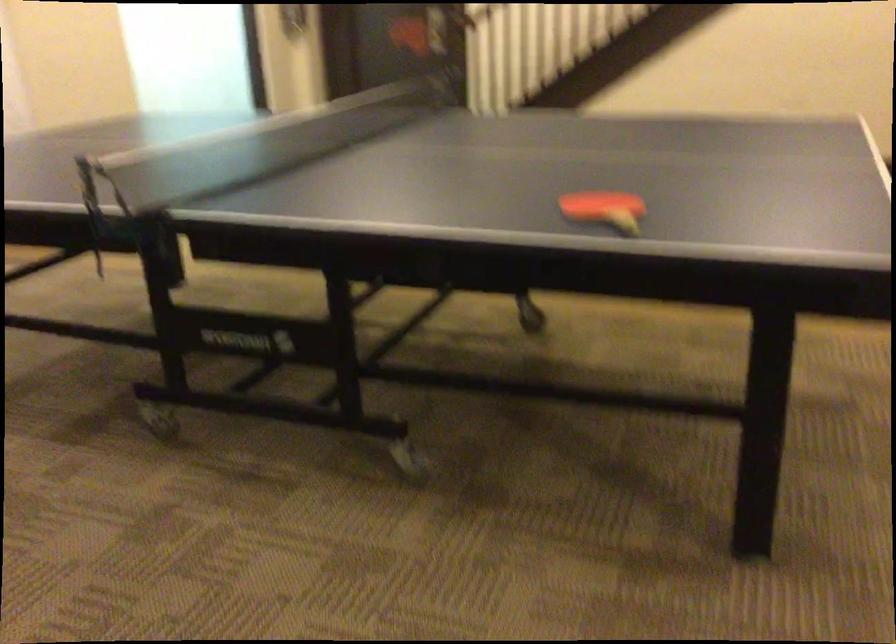
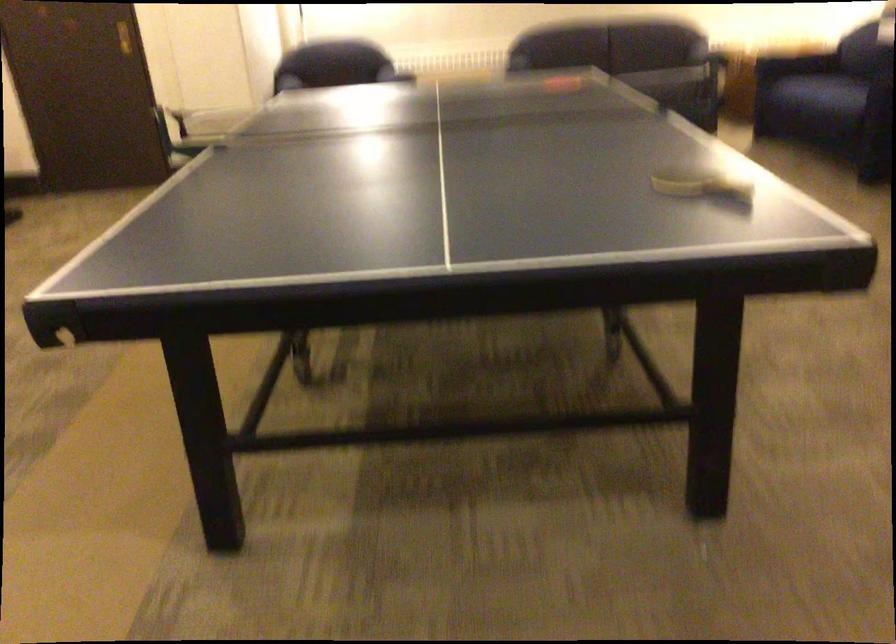
Find the pixel in the second image that matches pixel 128 205 in the first image.

(668, 82)